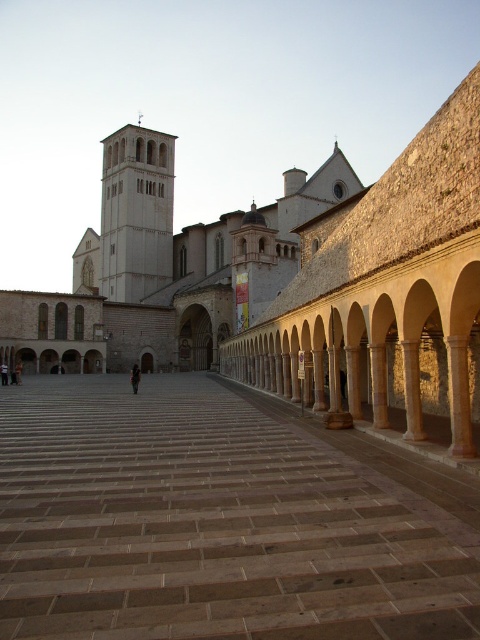
You are standing in the historic plaza and want to take a photo of both the brown stone courtyard at center and the white stone tower at center. Since you can only focus on one object at a time, which one should you aim the camera at first to ensure the other is still in the frame?

Since the brown stone courtyard at center is below the white stone tower at center, you should aim the camera at the white stone tower at center first. This way, the courtyard will naturally be in the lower part of the frame and remain visible.

You are standing at the entrance of the plaza and want to take a photo that includes both point [134,554] and point [103,212]. Which point should you focus on to ensure both are in sharp focus?

Answer: You should focus on point [103,212] because it is farther from the camera than point [134,554]. By focusing on the farther point, the closer point will also be within the depth of field, ensuring both are in sharp focus.